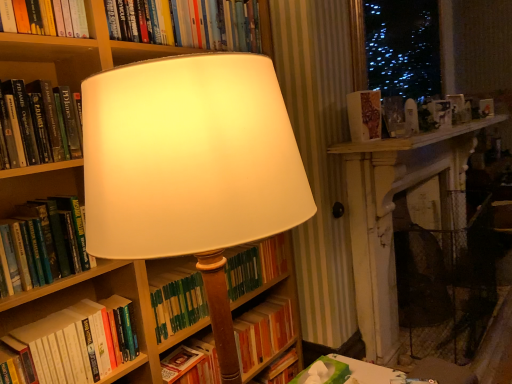
Question: Which direction should I rotate to face green matte book at center, which is counted as the 3th book, starting from the bottom, — up or down?

Choices:
 (A) up
 (B) down

Answer: (B)

Question: Is hardcover book at left, which appears as the third book when viewed from the top, positioned beyond the bounds of wooden bookcase at center?

Choices:
 (A) yes
 (B) no

Answer: (A)

Question: Considering the relative sizes of hardcover book at left, acting as the fifth book starting from the bottom, and wooden bookcase at center in the image provided, is hardcover book at left, acting as the fifth book starting from the bottom, bigger than wooden bookcase at center?

Choices:
 (A) yes
 (B) no

Answer: (B)

Question: Considering the relative sizes of hardcover book at left, acting as the fifth book starting from the bottom, and wooden bookcase at center in the image provided, is hardcover book at left, acting as the fifth book starting from the bottom, shorter than wooden bookcase at center?

Choices:
 (A) yes
 (B) no

Answer: (A)

Question: Is wooden bookcase at center at the back of hardcover book at left, which appears as the third book when viewed from the top?

Choices:
 (A) no
 (B) yes

Answer: (A)

Question: From a real-world perspective, does hardcover book at left, which appears as the third book when viewed from the top, stand above wooden bookcase at center?

Choices:
 (A) yes
 (B) no

Answer: (A)

Question: From a real-world perspective, does hardcover book at left, acting as the fifth book starting from the bottom, sit lower than wooden bookcase at center?

Choices:
 (A) yes
 (B) no

Answer: (B)

Question: From the image's perspective, is wooden bookcase at center below hardcover book at upper center, arranged as the first book when viewed from the top?

Choices:
 (A) yes
 (B) no

Answer: (A)

Question: Is wooden bookcase at center at the left side of hardcover book at upper center, arranged as the first book when viewed from the top?

Choices:
 (A) no
 (B) yes

Answer: (A)

Question: Is wooden bookcase at center at the right side of hardcover book at upper center, which ranks as the seventh book in bottom-to-top order?

Choices:
 (A) yes
 (B) no

Answer: (A)

Question: Is hardcover book at upper center, arranged as the first book when viewed from the top, surrounded by wooden bookcase at center?

Choices:
 (A) yes
 (B) no

Answer: (B)

Question: Considering the relative sizes of wooden bookcase at center and hardcover book at upper center, which ranks as the seventh book in bottom-to-top order, in the image provided, is wooden bookcase at center wider than hardcover book at upper center, which ranks as the seventh book in bottom-to-top order,?

Choices:
 (A) yes
 (B) no

Answer: (A)

Question: From a real-world perspective, is wooden bookcase at center over hardcover book at upper center, which ranks as the seventh book in bottom-to-top order?

Choices:
 (A) yes
 (B) no

Answer: (B)

Question: Considering the relative sizes of patterned paper book at upper right, which is the 2th book from top to bottom, and green hardcover book at center, which appears as the seventh book when viewed from the top, in the image provided, is patterned paper book at upper right, which is the 2th book from top to bottom, bigger than green hardcover book at center, which appears as the seventh book when viewed from the top,?

Choices:
 (A) no
 (B) yes

Answer: (A)